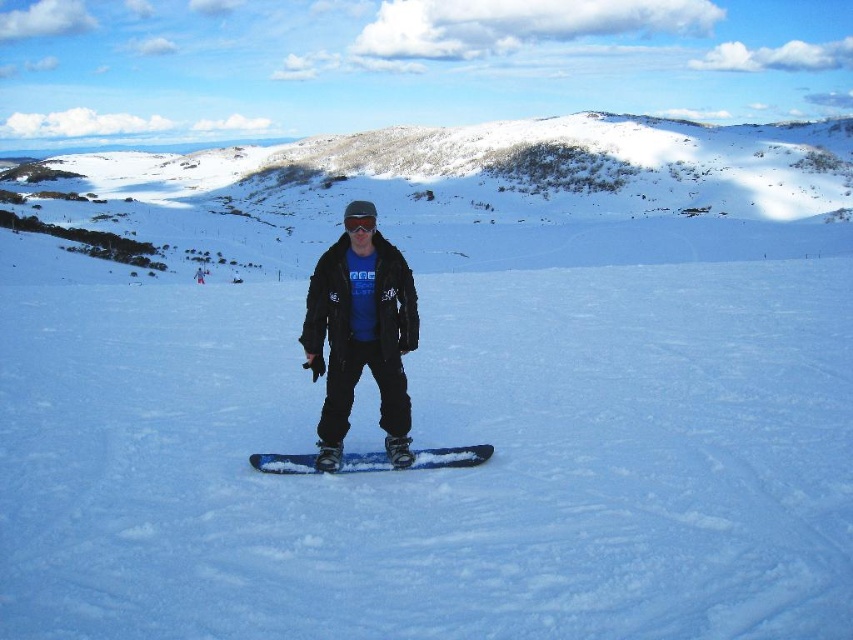
Question: Estimate the real-world distances between objects in this image. Which object is closer to the black matte goggles at center?

Choices:
 (A) matte black snowboarder at center
 (B) blue matte snowboard at center
 (C) snowy/icy mountain at upper center

Answer: (A)

Question: Among these objects, which one is nearest to the camera?

Choices:
 (A) black matte goggles at center
 (B) matte black snowboard at center
 (C) matte black snowboarder at center
 (D) snowy/icy mountain at upper center

Answer: (B)

Question: Considering the relative positions of matte black snowboard at center and black matte goggles at center in the image provided, where is matte black snowboard at center located with respect to black matte goggles at center?

Choices:
 (A) below
 (B) above

Answer: (A)

Question: Which object appears farthest from the camera in this image?

Choices:
 (A) black matte goggles at center
 (B) matte black snowboarder at center
 (C) blue matte snowboard at center
 (D) snowy/icy mountain at upper center

Answer: (D)

Question: Is blue matte snowboard at center below black matte goggles at center?

Choices:
 (A) no
 (B) yes

Answer: (B)

Question: Is blue matte snowboard at center positioned at the back of black matte goggles at center?

Choices:
 (A) no
 (B) yes

Answer: (A)